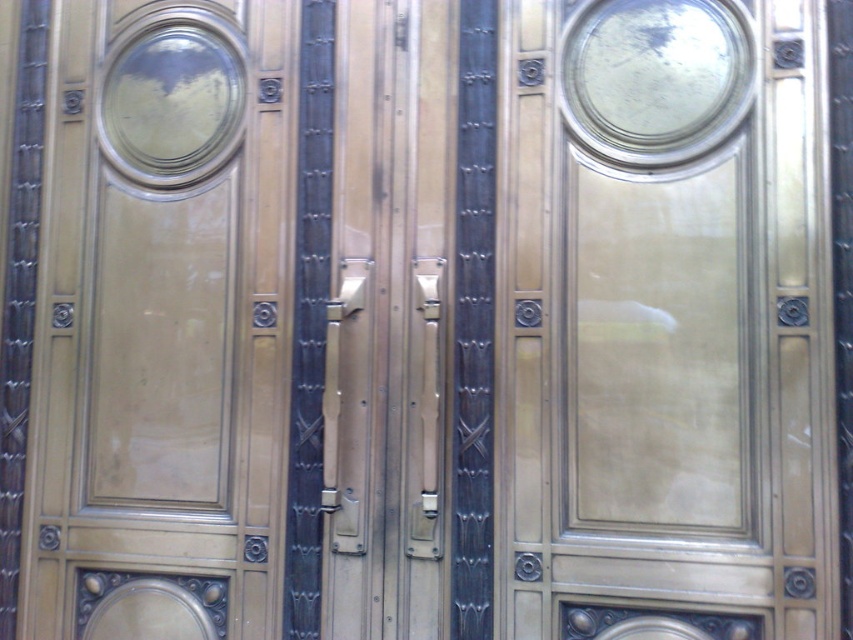
Looking at this image, you are standing in front of the double doors described in the scene. There is a point labeled as point (665,321). Which object does this point belong to?

The point (665,321) belongs to the matte gold glass door at center.

You are standing in front of the double doors and want to reach a keyhole located at point (598, 49). If your arm can extend 1.5 meters, can you reach it?

The distance between you and the keyhole at point (598, 49) is 3.65 meters, which is farther than your arm can reach. You cannot reach it with your arm extended to 1.5 meters.

You are an interior designer assessing the symmetry of the double doors. Which door has a smaller size between the matte gold glass door at center and the metallic gold door at left?

The matte gold glass door at center is smaller than the metallic gold door at left.